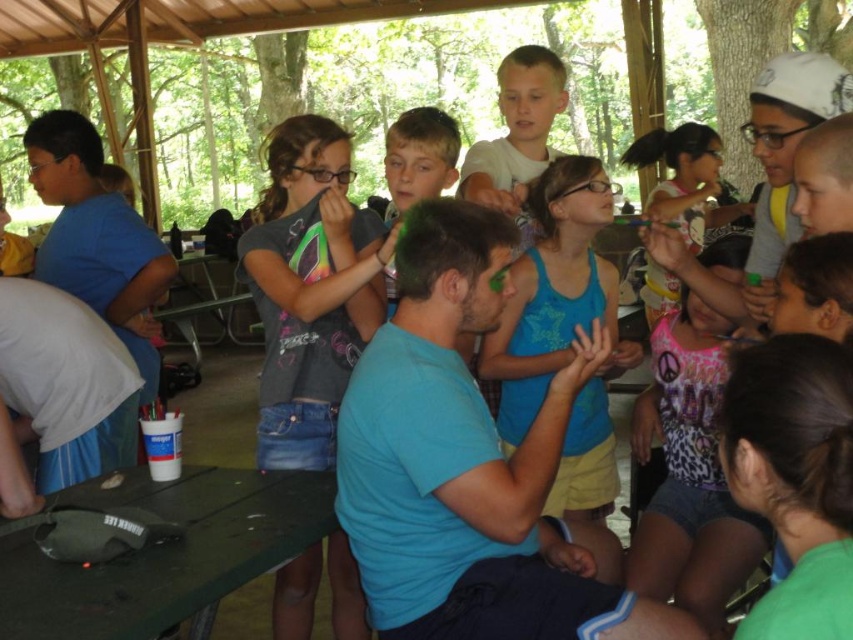
Question: Does green matte fanny pack at lower left have a greater width compared to blue cotton tank top at center?

Choices:
 (A) no
 (B) yes

Answer: (B)

Question: Estimate the real-world distances between objects in this image. Which object is farther from the pink leopard print tank top at center?

Choices:
 (A) green matte fanny pack at lower left
 (B) blue cotton tank top at center

Answer: (A)

Question: Does matte gray shirt at center appear under blue cotton tank top at center?

Choices:
 (A) yes
 (B) no

Answer: (A)

Question: Based on their relative distances, which object is farther from the green matte fanny pack at lower left?

Choices:
 (A) pink leopard print tank top at center
 (B) blue cotton tank top at center
 (C) matte gray shirt at center

Answer: (A)

Question: Is the position of matte gray shirt at center less distant than that of green matte fanny pack at lower left?

Choices:
 (A) yes
 (B) no

Answer: (B)

Question: Which of the following is the closest to the observer?

Choices:
 (A) matte gray shirt at center
 (B) pink leopard print tank top at center
 (C) green matte fanny pack at lower left

Answer: (C)